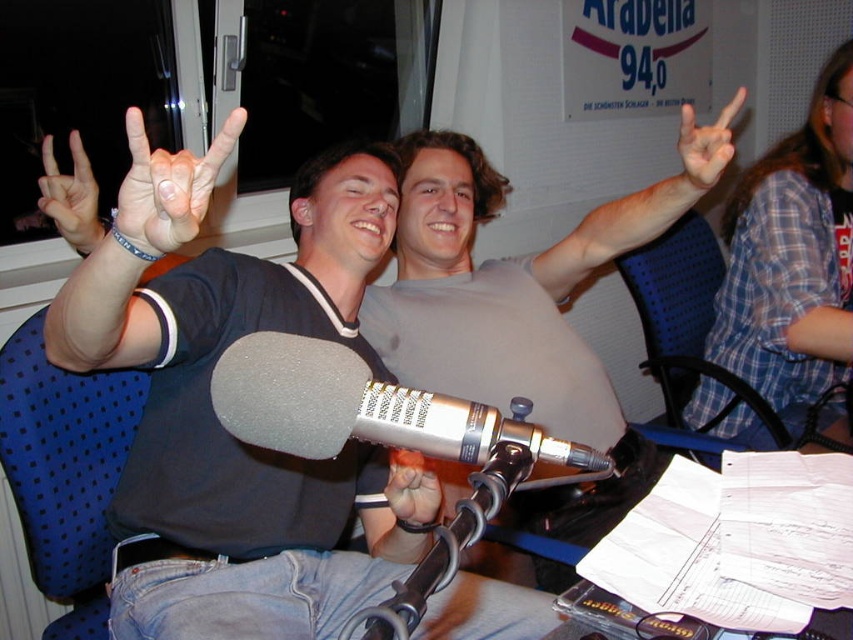
You are a photographer in the studio and want to capture a photo where the gray matte microphone at center is clearly visible without any obstruction. Is the white matte hand at upper right blocking the microphone?

The white matte hand at upper right is behind the gray matte microphone at center, so it is not blocking the microphone and the microphone remains visible.

Consider the image. You are a photographer in a radio studio. You need to capture a closeup of the matte black hand at upper left and the white matte hand at upper left. Which hand should you focus on to ensure the other is in the background?

You should focus on the matte black hand at upper left because it is in front of the white matte hand at upper left, so the white matte hand at upper left will be in the background.